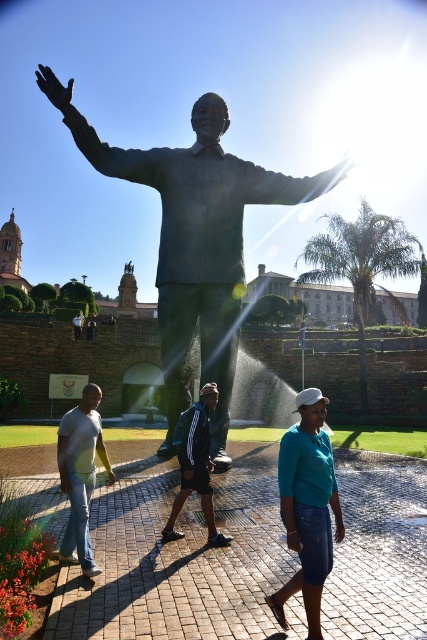
You are a photographer trying to capture the bronze statue at center and the teal matte shirt at center in the same frame. Based on their sizes, which object will appear larger in the photo?

The bronze statue at center is much taller than the teal matte shirt at center, so it will appear larger in the photo.

Based on the photo, you are planning to take a photo of the bronze statue at center and the teal matte shirt at center from a distance. Based on their sizes, which object should appear larger in the photo?

The bronze statue at center should appear larger in the photo because its width surpasses that of the teal matte shirt at center.